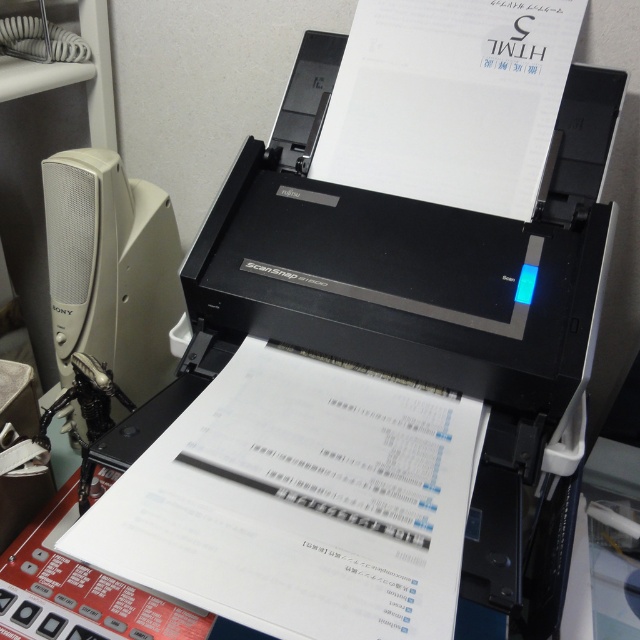
Question: Does white paper at center have a larger size compared to white plastic speaker at left?

Choices:
 (A) yes
 (B) no

Answer: (A)

Question: Is white paper at center smaller than white plastic speaker at left?

Choices:
 (A) no
 (B) yes

Answer: (A)

Question: Which object is positioned closest to the white paper at upper center?

Choices:
 (A) white paper at center
 (B) white plastic speaker at left

Answer: (A)

Question: Among these points, which one is nearest to the camera?

Choices:
 (A) (452, 12)
 (B) (237, 572)
 (C) (125, 298)

Answer: (B)

Question: Observing the image, what is the correct spatial positioning of white paper at center in reference to white paper at upper center?

Choices:
 (A) above
 (B) below

Answer: (B)

Question: Considering the real-world distances, which object is farthest from the white paper at upper center?

Choices:
 (A) white plastic speaker at left
 (B) white paper at center

Answer: (A)